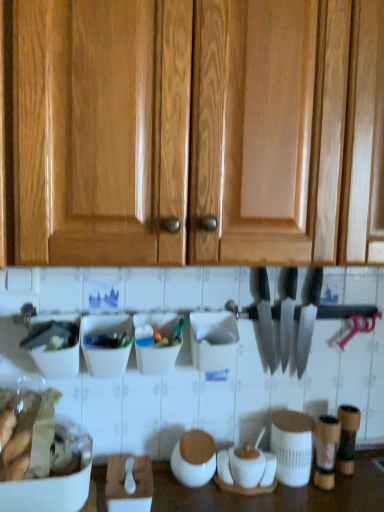
Question: Is white matte jar at center, the 1th appliance viewed from the left, inside or outside of polished silver knife at center, the 2th knife in the right-to-left sequence?

Choices:
 (A) outside
 (B) inside

Answer: (A)

Question: From their relative heights in the image, would you say white matte jar at center, which is the second appliance in right-to-left order, is taller or shorter than polished silver knife at center, the 2th knife in the right-to-left sequence?

Choices:
 (A) tall
 (B) short

Answer: (B)

Question: Which of these objects is positioned farthest from the polished silver knife at center, marked as the 1th knife in a right-to-left arrangement?

Choices:
 (A) white matte jar at center, the 2th appliance in the left-to-right sequence
 (B) polished silver knife at center, the 1th knife viewed from the left
 (C) white matte jar at center, which is the second appliance in right-to-left order
 (D) glossy wood cabinets at upper center

Answer: (D)

Question: Considering the real-world distances, which object is farthest from the polished silver knife at center, which is counted as the 2th knife, starting from the left?

Choices:
 (A) glossy wood cabinets at upper center
 (B) polished silver knife at center, the 1th knife viewed from the left
 (C) white matte jar at center, which is the second appliance in right-to-left order
 (D) white matte jar at center, the first appliance when ordered from right to left

Answer: (A)